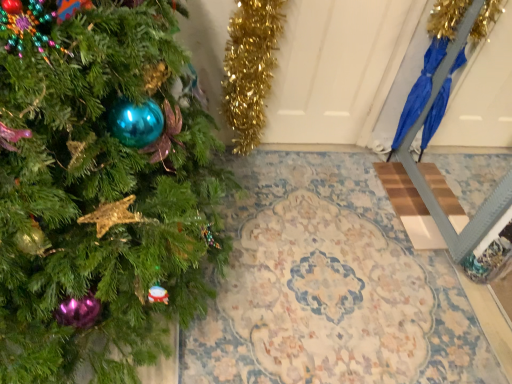
Find the location of `shiny green christmas tree at left`. shiny green christmas tree at left is located at coordinates (100, 198).

What do you see at coordinates (100, 198) in the screenshot?
I see `shiny green christmas tree at left` at bounding box center [100, 198].

In order to click on shiny green christmas tree at left in this screenshot , I will do `click(100, 198)`.